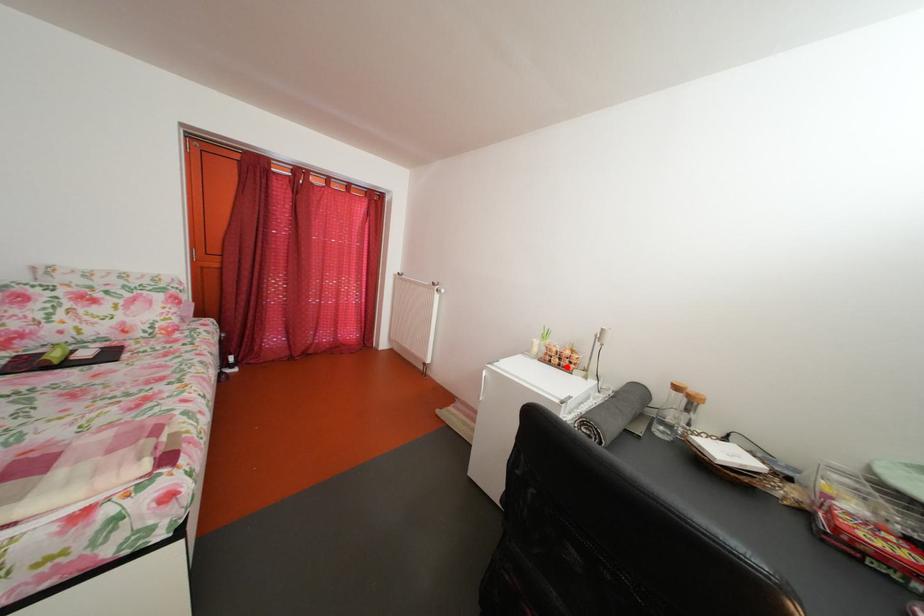
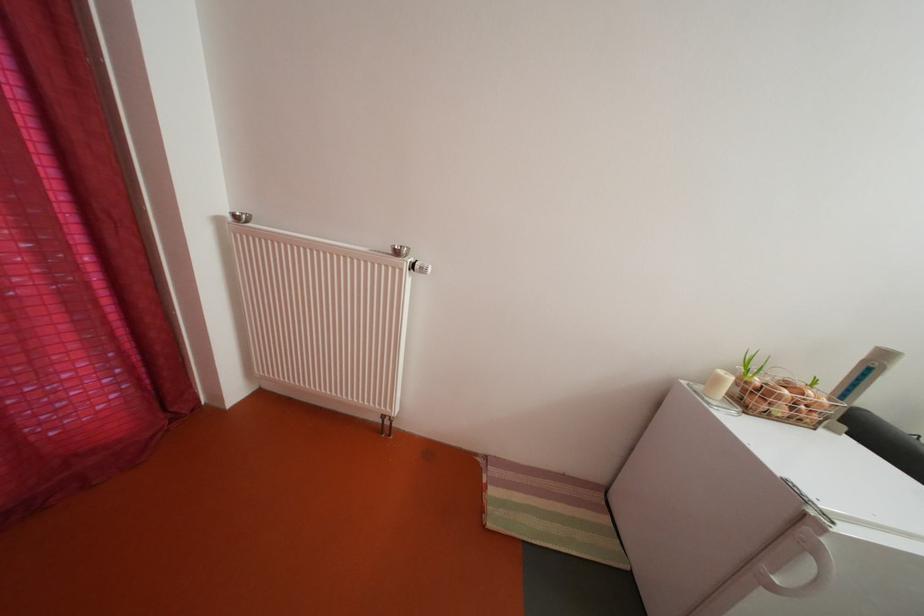
In the second image, find the point that corresponds to the highlighted location in the first image.

(792, 416)